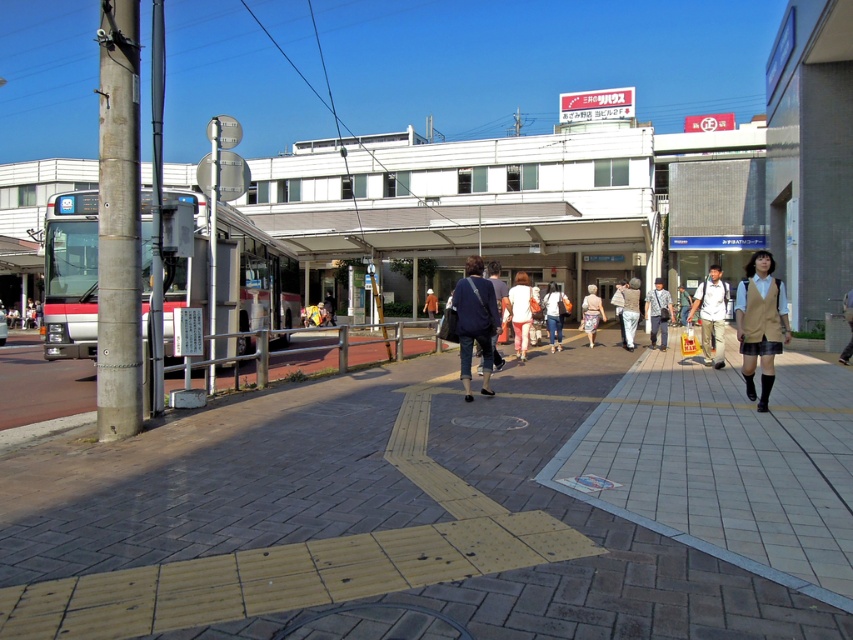
Question: Does light brown uniform skirt at lower right have a larger size compared to light beige backpack at center?

Choices:
 (A) yes
 (B) no

Answer: (B)

Question: Estimate the real-world distances between objects in this image. Which object is closer to the dark gray fabric bag at center?

Choices:
 (A) dark blue fabric jacket at center
 (B) light brown uniform at center
 (C) light brown uniform skirt at lower right

Answer: (B)

Question: Does denim jacket at center appear on the right side of orange fabric jacket at center?

Choices:
 (A) no
 (B) yes

Answer: (B)

Question: Is denim pants at center positioned in front of light beige pants at center?

Choices:
 (A) yes
 (B) no

Answer: (A)

Question: Which of the following is the farthest from the observer?

Choices:
 (A) light brown uniform skirt at lower right
 (B) light brown fabric jacket at center
 (C) dark blue jeans at center

Answer: (C)

Question: Which of these objects is positioned closest to the khaki uniform at center?

Choices:
 (A) light brown uniform at center
 (B) denim pants at center
 (C) dark gray fabric bag at center
 (D) light brown uniform skirt at lower right

Answer: (C)